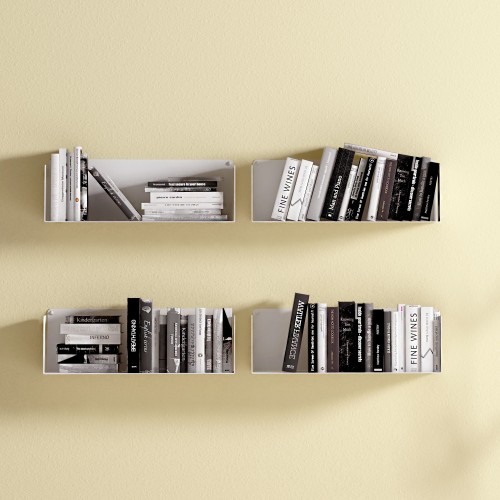
Identify the location of shelves. (133, 188), (263, 196), (48, 341), (267, 337).